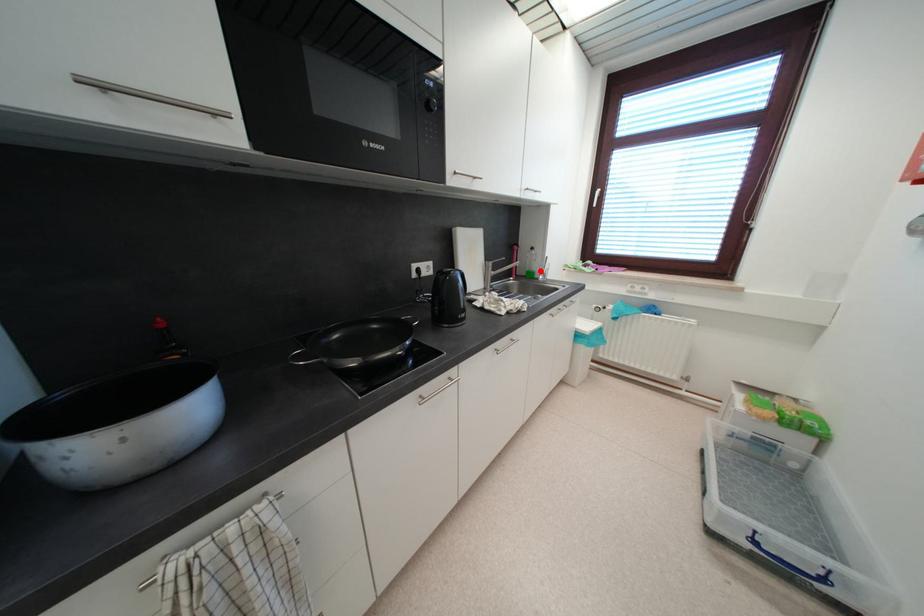
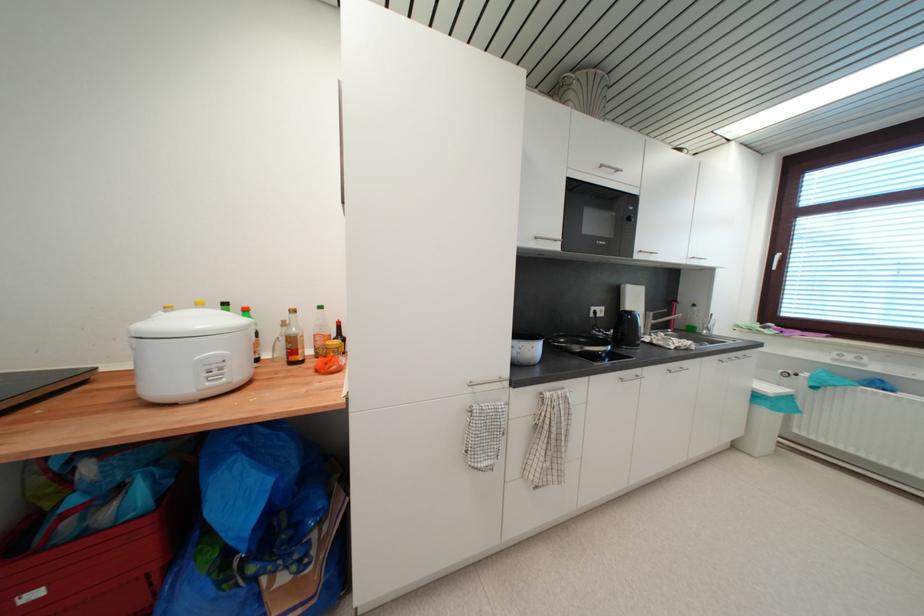
Where in the second image is the point corresponding to the highlighted location from the first image?

(701, 326)